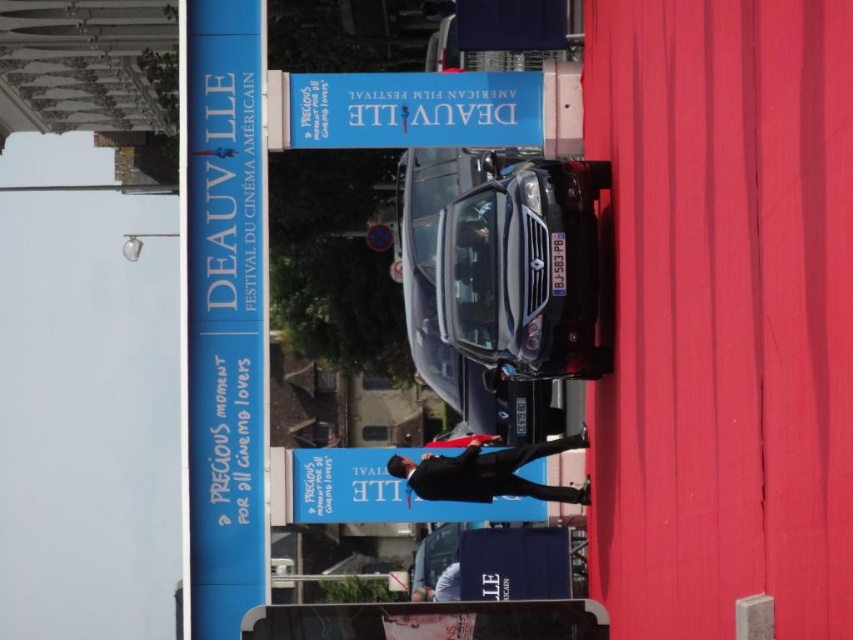
Does blue plastic signboard at center have a smaller size compared to blue fabric sign at center?

No.

Is blue plastic signboard at center thinner than blue fabric sign at center?

No, blue plastic signboard at center is not thinner than blue fabric sign at center.

Find the location of a particular element. blue plastic signboard at center is located at coordinates (415, 109).